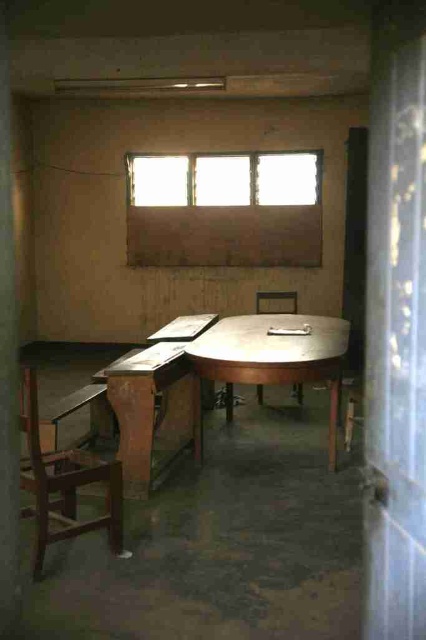
Consider the image. You are trying to decide where to place a large potted plant in the room. The wooden at left and wooden chair at center are both potential spots. Based on their sizes, which object would be more suitable for placing the plant?

The wooden at left is bigger than the wooden chair at center, so it would be more suitable for placing the large potted plant.

You are organizing a meeting in the room and need to place a large rectangular board that is 2 meters wide between the metallic polished table at center and the wooden at left. Based on their widths, will the board fit between them?

The metallic polished table at center is wider than the wooden at left, so the board may not fit between them if the space between them is narrower than 2 meters. However, the exact distance isn generated from the provided information.

You are standing in the room and want to reach both the point at coordinates (273,378) and the point at (43,547). Which point should you approach first if you want to reach the one closer to you first?

You should approach point (43,547) first because it is closer to you than point (273,378), which is further away.